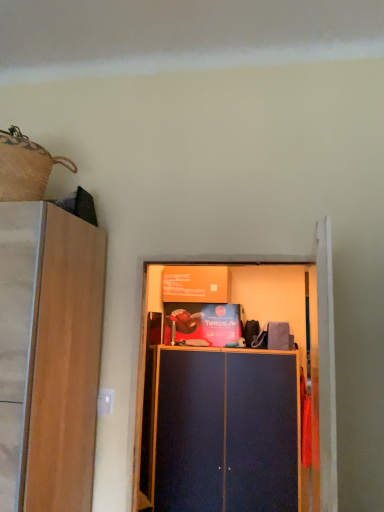
You are a GUI agent. You are given a task and a screenshot of the screen. Output one action in this format:
    pyautogui.click(x=<x>, y=<y>)
    Task: Click on the blank space situated above blue matte cupboard at center (from a real-world perspective)
    The image size is (384, 512).
    Given the screenshot: What is the action you would take?
    pyautogui.click(x=225, y=261)